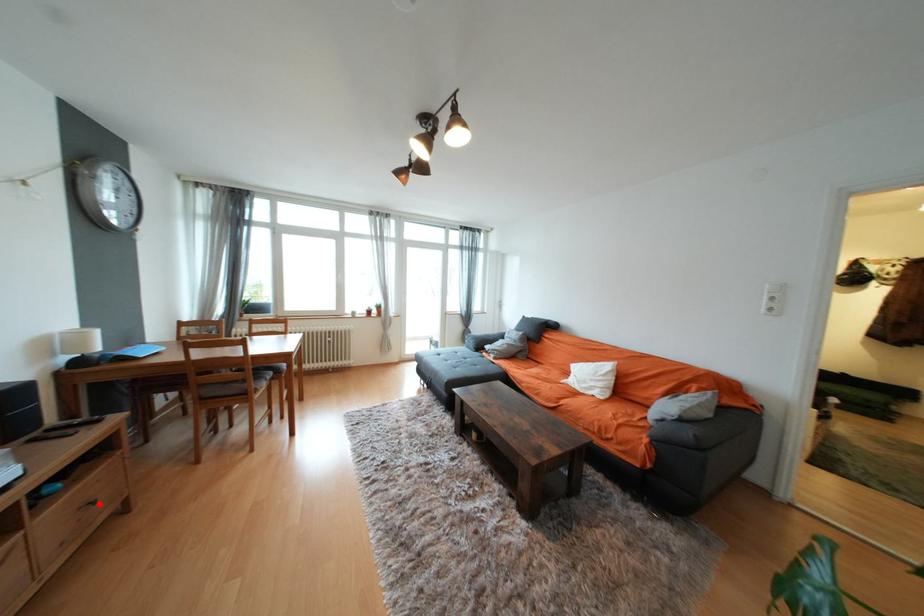
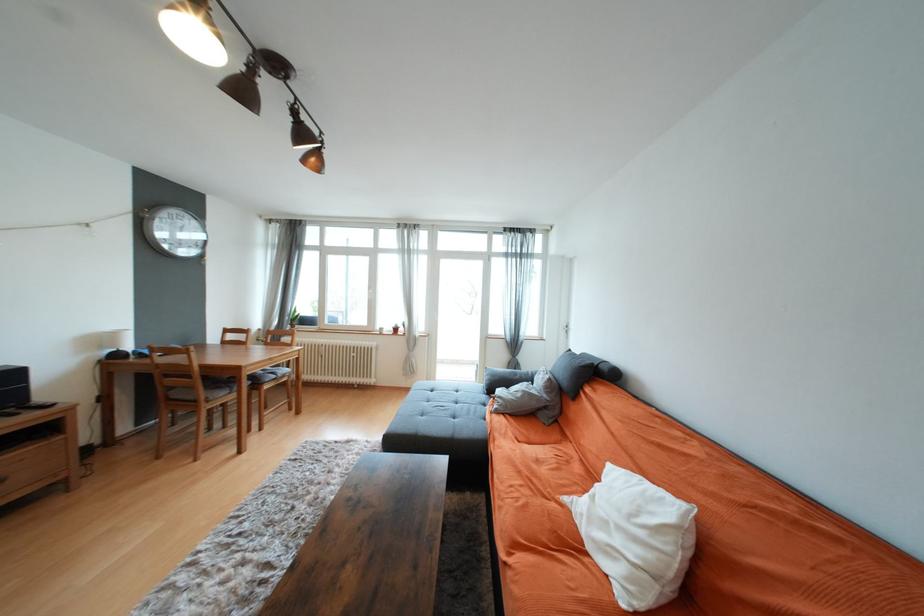
Where in the second image is the point corresponding to the highlighted location from the first image?

(7, 482)